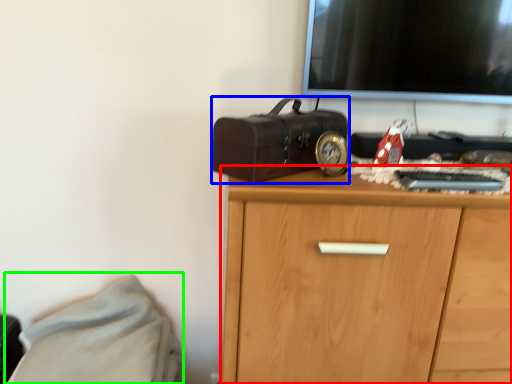
Question: Which object is positioned closest to chest of drawers (highlighted by a red box)? Select from suitcase (highlighted by a blue box) and bed (highlighted by a green box).

Choices:
 (A) suitcase
 (B) bed

Answer: (A)